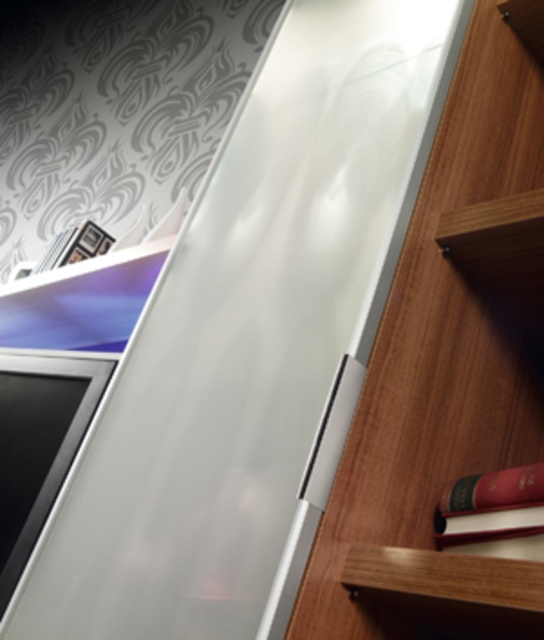
Question: Which of the following is the farthest from the observer?

Choices:
 (A) (496, 401)
 (B) (503, 524)

Answer: (A)

Question: Can you confirm if red leather book at lower right is wider than wooden bookcase at right?

Choices:
 (A) no
 (B) yes

Answer: (A)

Question: Does red leather book at lower right lie in front of wooden bookcase at right?

Choices:
 (A) yes
 (B) no

Answer: (B)

Question: Which point is farther to the camera?

Choices:
 (A) red leather book at lower right
 (B) wooden bookcase at right

Answer: (A)

Question: Can you confirm if red leather book at lower right is positioned below wooden bookcase at right?

Choices:
 (A) no
 (B) yes

Answer: (B)